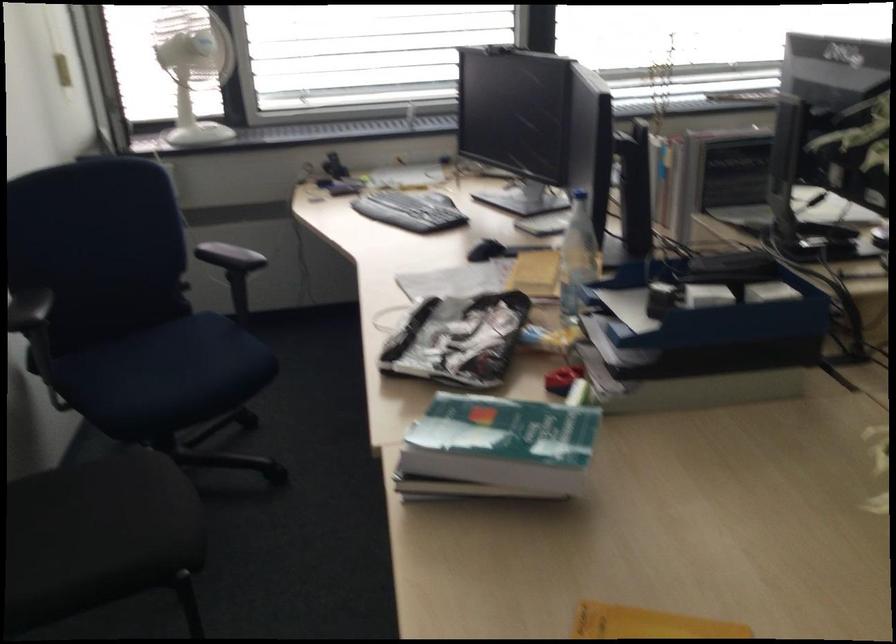
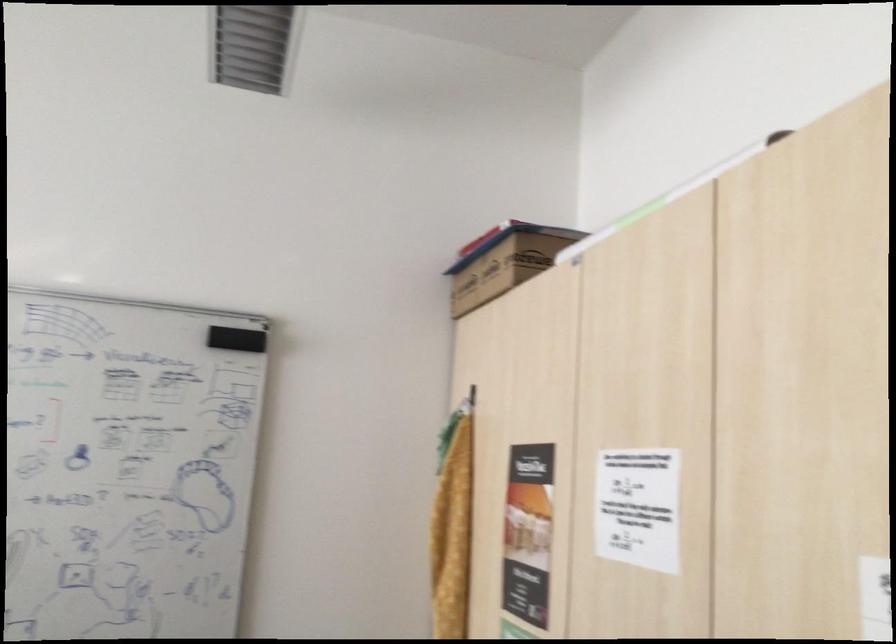
Question: The images are taken continuously from a first-person perspective. In which direction is your viewpoint rotating?

Choices:
 (A) Left
 (B) Right
 (C) Up
 (D) Down

Answer: (B)